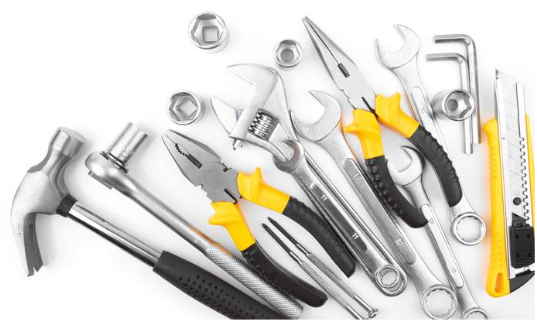
The width and height of the screenshot is (537, 322). I want to click on sockets, so click(x=126, y=140), click(x=183, y=113), click(x=212, y=27), click(x=286, y=45), click(x=455, y=98).